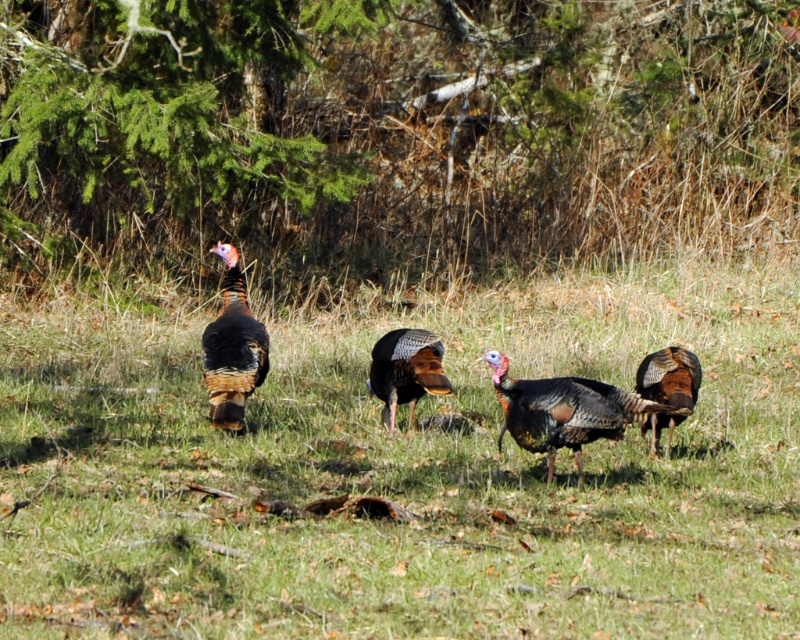
You are a photographer trying to capture the glossy iridescent turkey at center in the image. The camera is positioned at the point marked by point (554, 412). Where should you aim your camera to focus on the glossy iridescent turkey at center?

The point (554, 412) marks the glossy iridescent turkey at center, so you should aim your camera directly at that point to focus on it.

You are a photographer aiming to capture both the glossy iridescent turkey at center and the shiny metallic turkey at center in a single frame. Which turkey should you adjust your camera angle to focus on first to ensure both are in the shot?

You should focus on the glossy iridescent turkey at center first because it is positioned under the shiny metallic turkey at center, so adjusting the angle to include the lower one ensures the upper one is also in frame.

You are a photographer aiming to capture the shiny brown turkey at right in your shot. The green grass at center is blocking the view. Can you move the grass to get a clear view of the turkey?

The shiny brown turkey at right is behind the green grass at center, so you cannot move the grass as it is part of the natural environment. To get a clear view, you might need to adjust your position or angle to see around or over the grass.